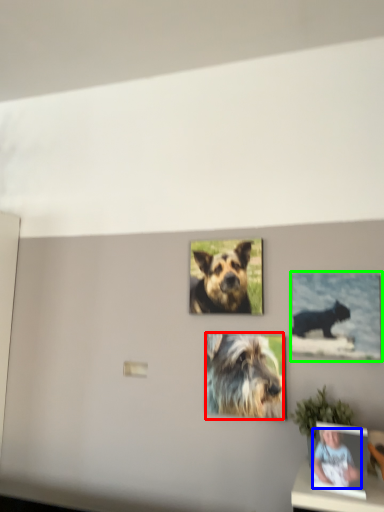
Question: Which object is the farthest from dog (highlighted by a red box)? Choose among these: person (highlighted by a blue box) or picture frame (highlighted by a green box).

Choices:
 (A) person
 (B) picture frame

Answer: (A)